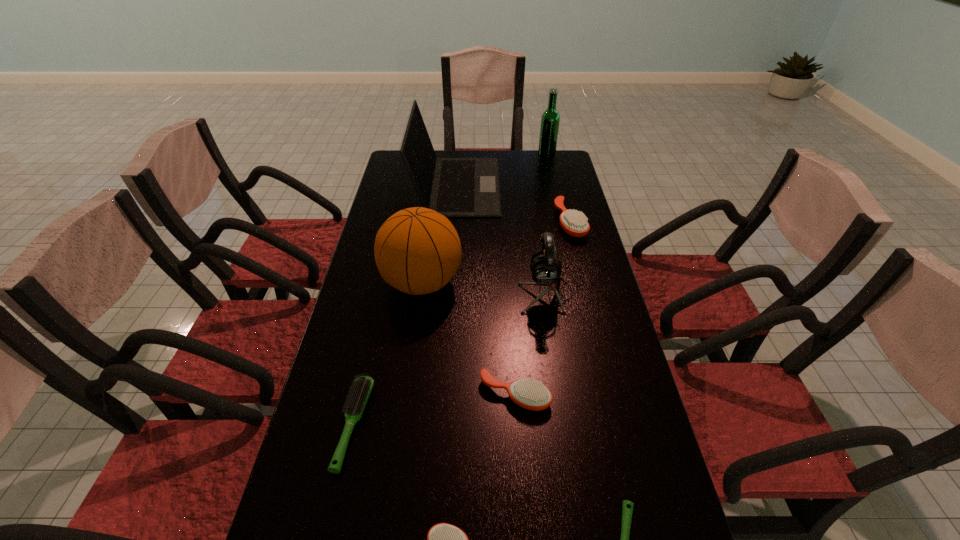
In order to click on laptop positioned at the left edge in this screenshot , I will do tap(455, 187).

Image resolution: width=960 pixels, height=540 pixels. Identify the location of basketball that is at the left edge. (417, 250).

The height and width of the screenshot is (540, 960). In order to click on hairbrush present at the left edge in this screenshot , I will do click(x=361, y=389).

At what (x,y) coordinates should I click in order to perform the action: click on beer bottle at the right edge. Please return your answer as a coordinate pair (x, y). This screenshot has width=960, height=540. Looking at the image, I should click on (550, 119).

Image resolution: width=960 pixels, height=540 pixels. What are the coordinates of `earphone situated at the right edge` in the screenshot? It's located at (546, 270).

The height and width of the screenshot is (540, 960). In order to click on hairbrush present at the right edge in this screenshot , I will do `click(574, 223)`.

Where is `object located at the far left corner`? object located at the far left corner is located at coordinates (455, 187).

Identify the location of object that is at the far right corner. (550, 119).

Where is `vacant region at the far edge of the desktop`? vacant region at the far edge of the desktop is located at coordinates (524, 151).

This screenshot has height=540, width=960. I want to click on vacant space at the left edge of the desktop, so click(385, 282).